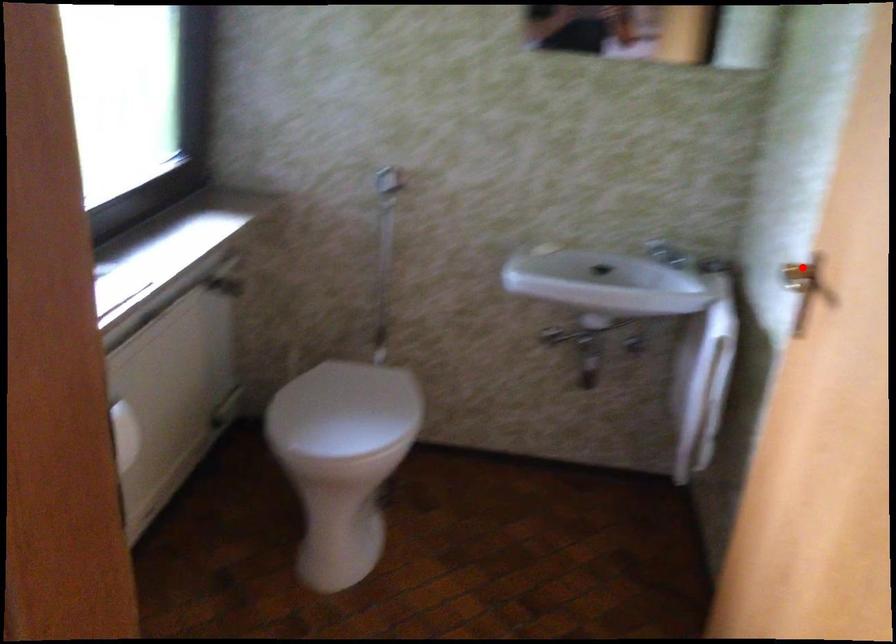
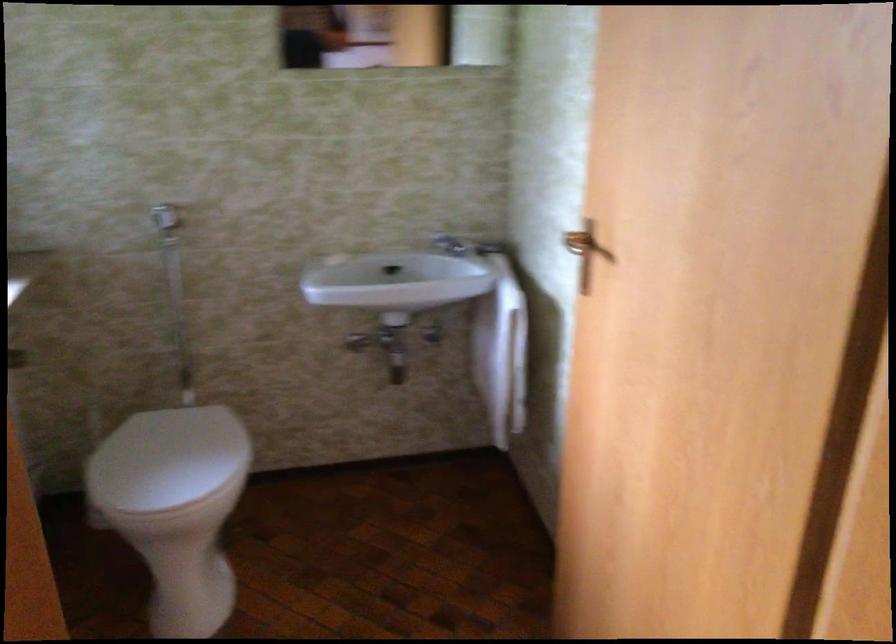
Locate, in the second image, the point that corresponds to the highlighted location in the first image.

(578, 242)